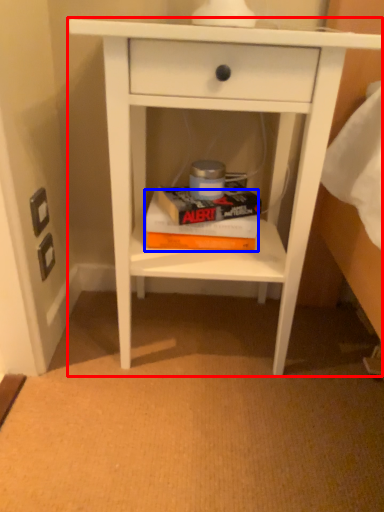
Question: Which object is closer to the camera taking this photo, nightstand (highlighted by a red box) or paperback book (highlighted by a blue box)?

Choices:
 (A) nightstand
 (B) paperback book

Answer: (A)